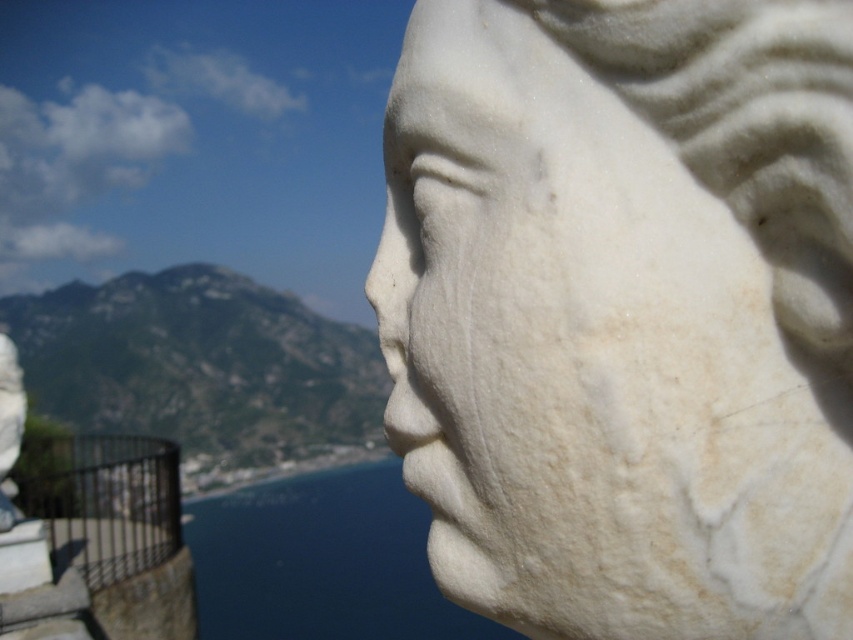
Is point (447, 452) less distant than point (97, 538)?

Yes.

Can you confirm if white marble bust at right is taller than black metal rail at lower left?

No, white marble bust at right is not taller than black metal rail at lower left.

Does point (624, 321) come behind point (97, 524)?

No, (624, 321) is in front of (97, 524).

Locate an element on the screen. white marble bust at right is located at coordinates (625, 310).

Does white marble bust at right appear over white marble statue at left?

Yes.

Measure the distance between point (581,556) and camera.

Point (581,556) and camera are 25.07 inches apart.

You are a GUI agent. You are given a task and a screenshot of the screen. Output one action in this format:
    pyautogui.click(x=<x>, y=<y>)
    Task: Click on the white marble bust at right
    This screenshot has height=640, width=853.
    Given the screenshot: What is the action you would take?
    pyautogui.click(x=625, y=310)

Who is positioned more to the right, blue water at lower center or white marble statue at left?

blue water at lower center is more to the right.

Which is behind, point (415, 584) or point (16, 458)?

Positioned behind is point (415, 584).

The height and width of the screenshot is (640, 853). I want to click on blue water at lower center, so (322, 561).